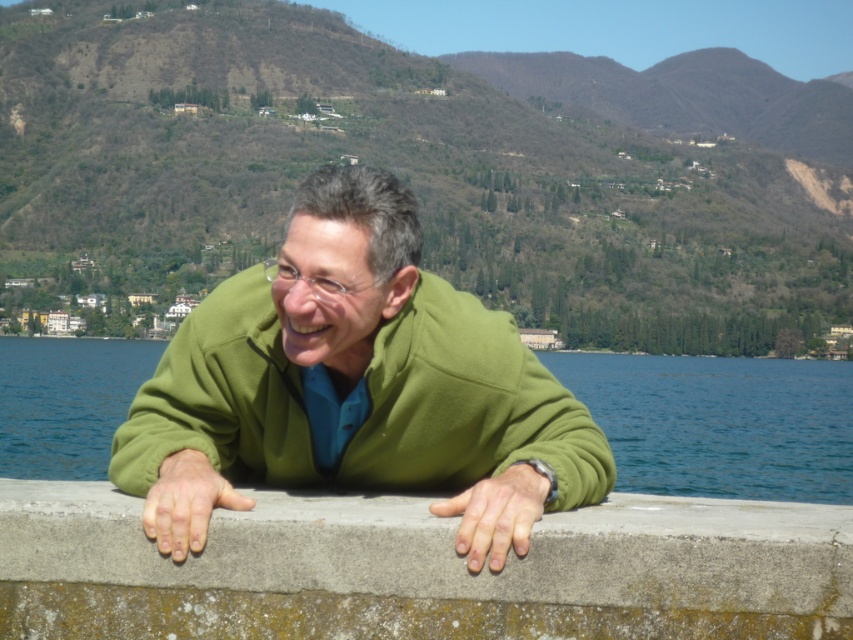
Is point (785, 552) more distant than point (62, 403)?

No.

Is point (775, 557) farther from viewer compared to point (831, 433)?

No, (775, 557) is closer to viewer.

Where is `gray concrete ledge at center`? The width and height of the screenshot is (853, 640). gray concrete ledge at center is located at coordinates (421, 570).

Is green matte jacket at center positioned before gray concrete ledge at center?

No, green matte jacket at center is behind gray concrete ledge at center.

Is point (277, 376) closer to viewer compared to point (669, 532)?

No, it is not.

This screenshot has height=640, width=853. I want to click on green matte jacket at center, so click(355, 387).

Measure the distance from green matte jacket at center to blue water at center.

green matte jacket at center and blue water at center are 857.01 feet apart from each other.

Between green matte jacket at center and blue water at center, which one is positioned lower?

Positioned lower is blue water at center.

Image resolution: width=853 pixels, height=640 pixels. Describe the element at coordinates (355, 387) in the screenshot. I see `green matte jacket at center` at that location.

I want to click on green matte jacket at center, so click(355, 387).